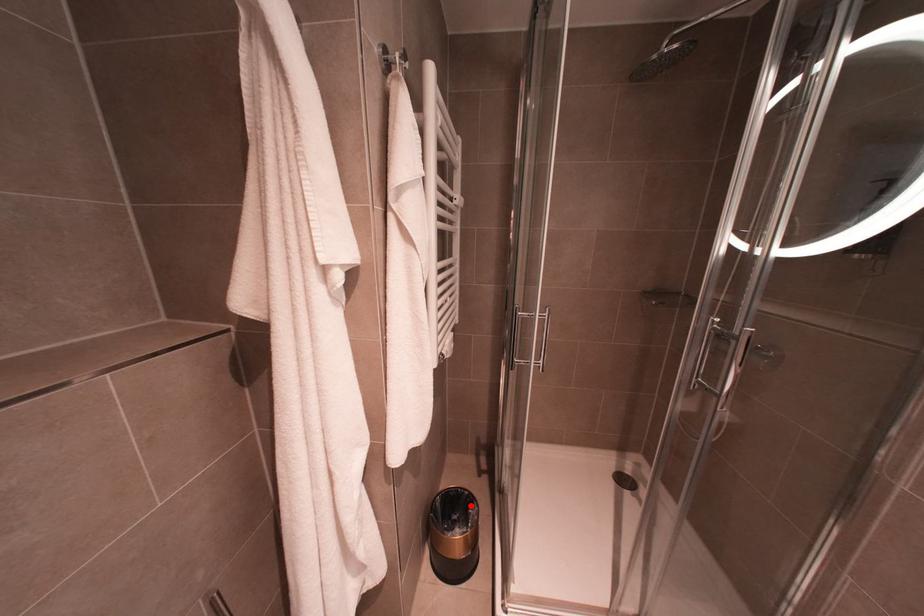
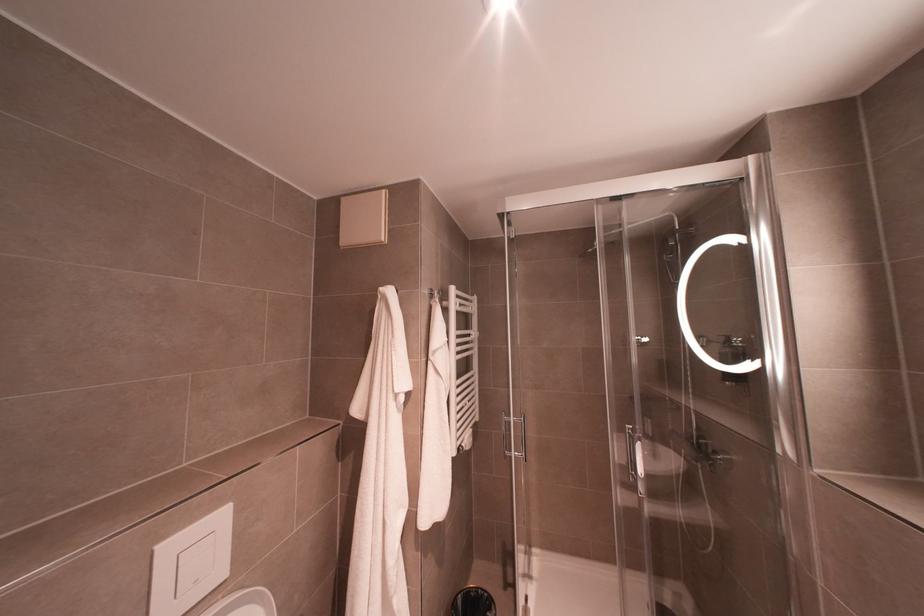
Question: I am providing you with two images of the same scene from different viewpoints. In image1, a red point is highlighted. Considering the same 3D point in image2, which of the following is correct?

Choices:
 (A) It is closer
 (B) It is farther

Answer: (B)